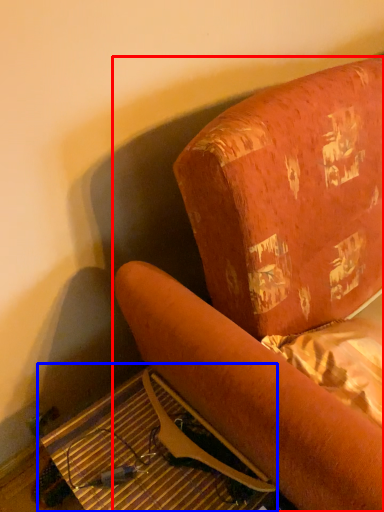
Question: Which object is further to the camera taking this photo, furniture (highlighted by a red box) or table (highlighted by a blue box)?

Choices:
 (A) furniture
 (B) table

Answer: (B)